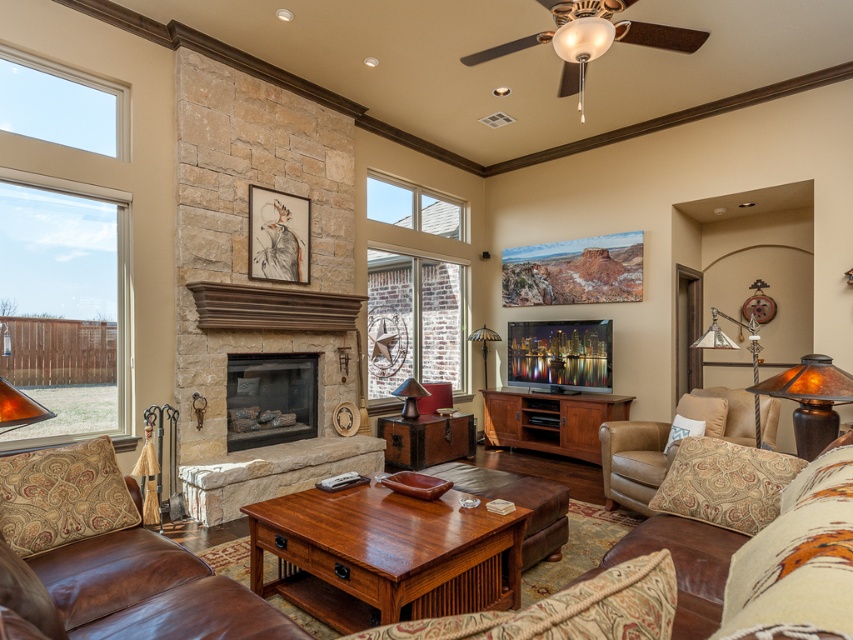
Identify the location of clear glass window at left. [x=64, y=305].

Can you confirm if clear glass window at left is thinner than natural stone fireplace at center?

No, clear glass window at left is not thinner than natural stone fireplace at center.

Consider the image. Who is more forward, (x=97, y=292) or (x=239, y=444)?

Point (x=97, y=292) is in front.

Find the location of a particular element. clear glass window at left is located at coordinates (64, 305).

Is point (45, 320) behind point (749, 336)?

That is False.

Is the position of clear glass window at left more distant than that of metallic silver floor lamp at right?

No, clear glass window at left is closer to the viewer.

Is point (65, 248) behind point (697, 340)?

Yes, it is.

This screenshot has height=640, width=853. What are the coordinates of `clear glass window at left` in the screenshot? It's located at (64, 305).

Is natural stone fireplace at center taller than metallic silver floor lamp at right?

Yes.

Which is above, natural stone fireplace at center or metallic silver floor lamp at right?

metallic silver floor lamp at right

Who is more forward, (286,404) or (750,316)?

Point (286,404)

Locate an element on the screen. The image size is (853, 640). natural stone fireplace at center is located at coordinates (270, 397).